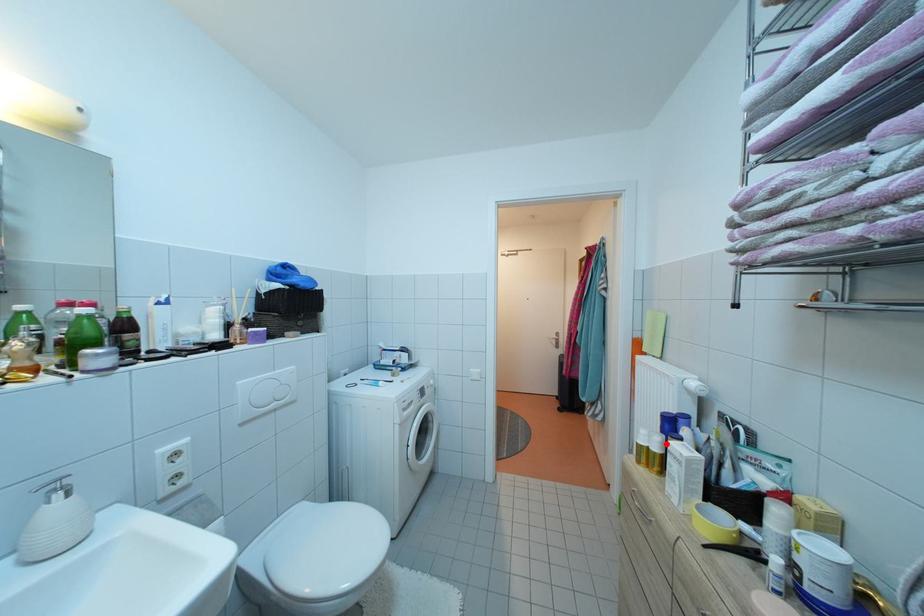
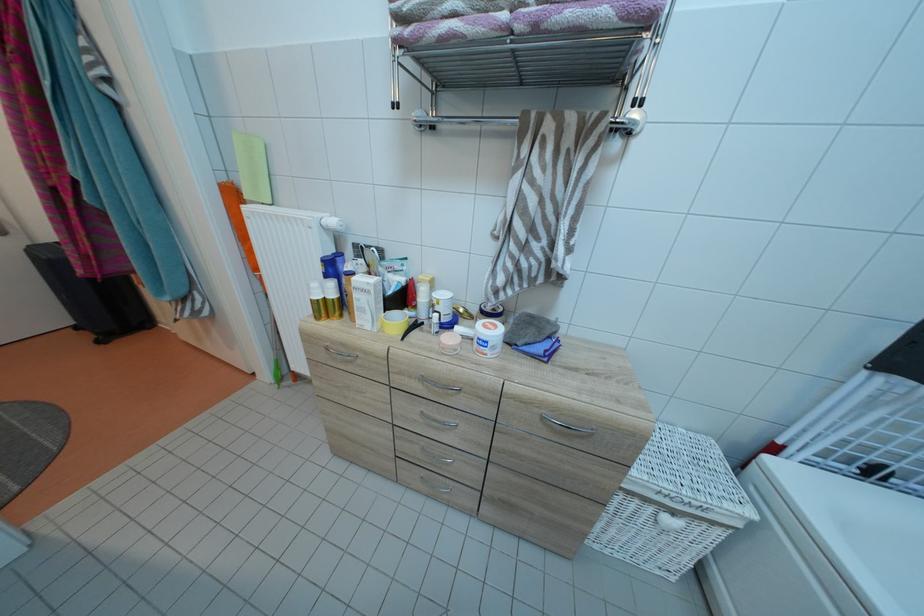
Where in the second image is the point corresponding to the highlighted location from the first image?

(338, 290)